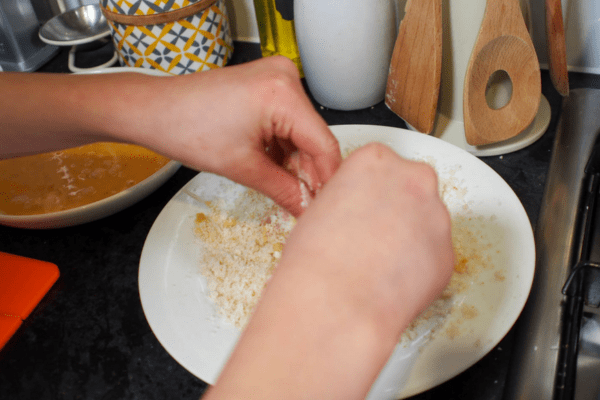
At what (x,y) coordinates should I click in order to perform the action: click on counter top. Please return your answer as a coordinate pair (x, y). The width and height of the screenshot is (600, 400). Looking at the image, I should click on (83, 322).